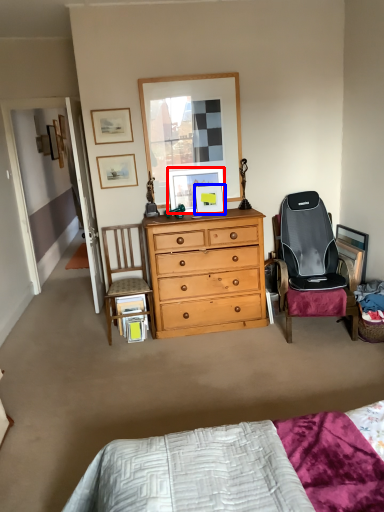
Question: Which of the following is the closest to the observer, picture frame (highlighted by a red box) or picture frame (highlighted by a blue box)?

Choices:
 (A) picture frame
 (B) picture frame

Answer: (A)